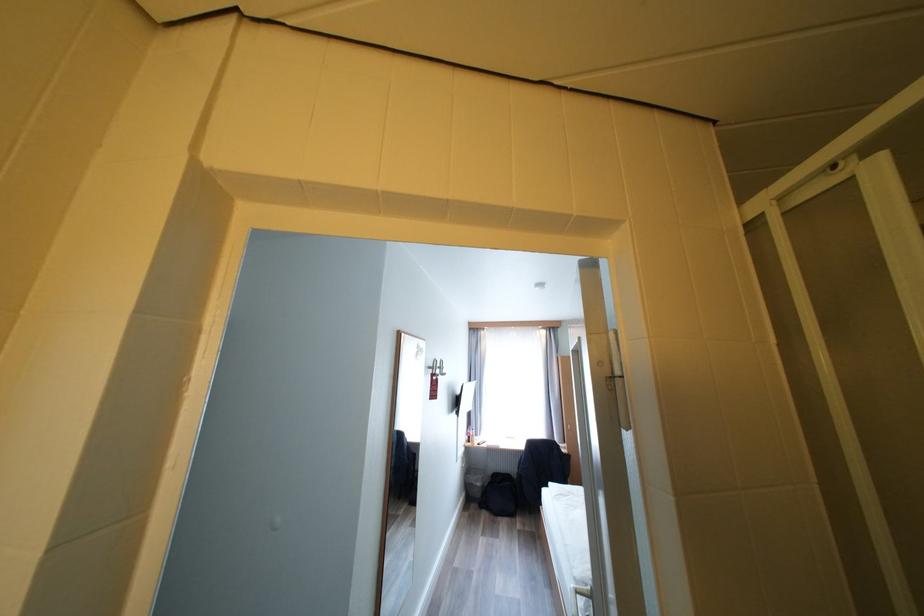
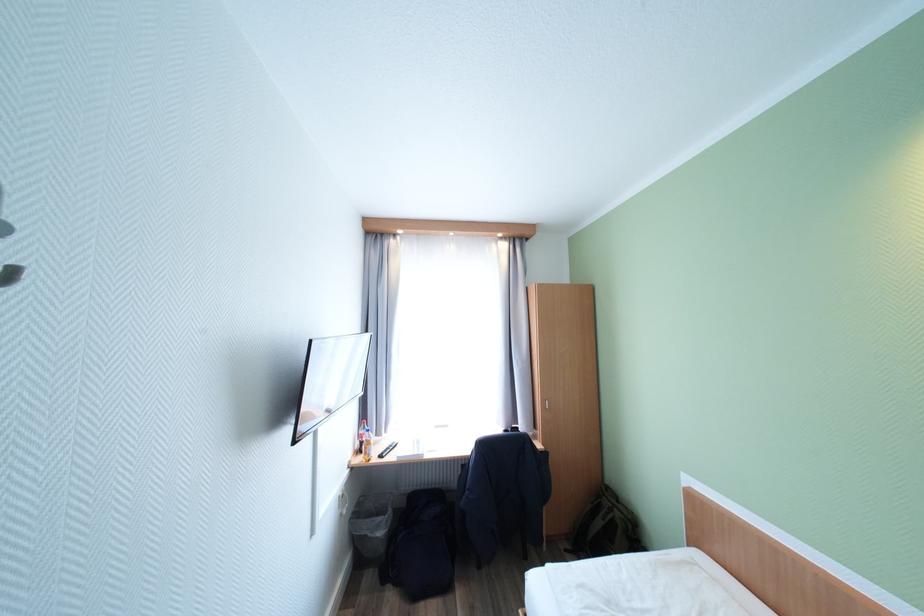
Where in the second image is the point corresponding to point 485,485 from the first image?

(387, 535)